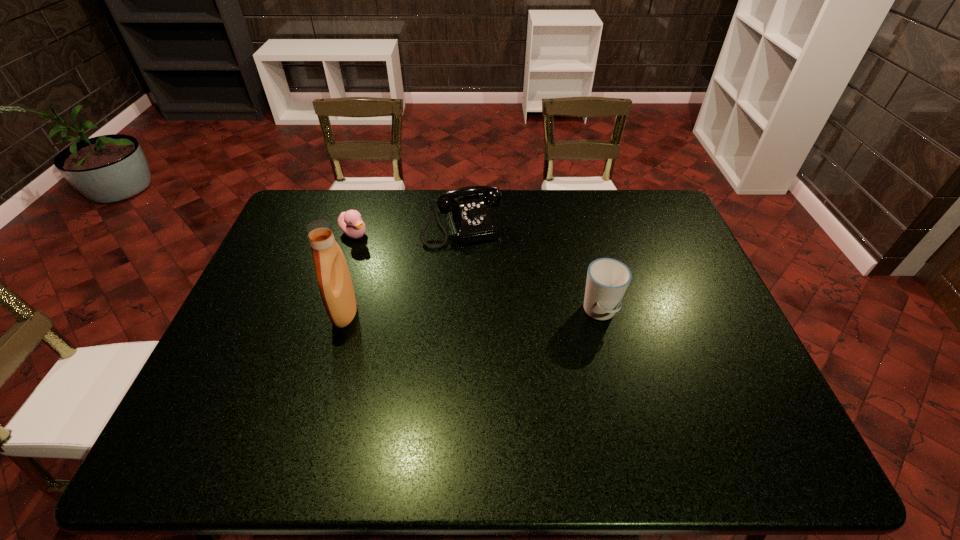
Locate which object is the third closest to the tallest object. Please provide its 2D coordinates. Your answer should be formatted as a tuple, i.e. [(x, y)], where the tuple contains the x and y coordinates of a point satisfying the conditions above.

[(607, 280)]

The image size is (960, 540). Identify the location of object that is the third closest to the detergent. (607, 280).

In order to click on free location that satisfies the following two spatial constraints: 1. on the back side of the second object from right to left; 2. on the left side of the shortest object in this screenshot , I will do `click(356, 225)`.

The height and width of the screenshot is (540, 960). I want to click on vacant point that satisfies the following two spatial constraints: 1. on the front side of the detergent; 2. on the front-facing side of the duckling, so click(329, 312).